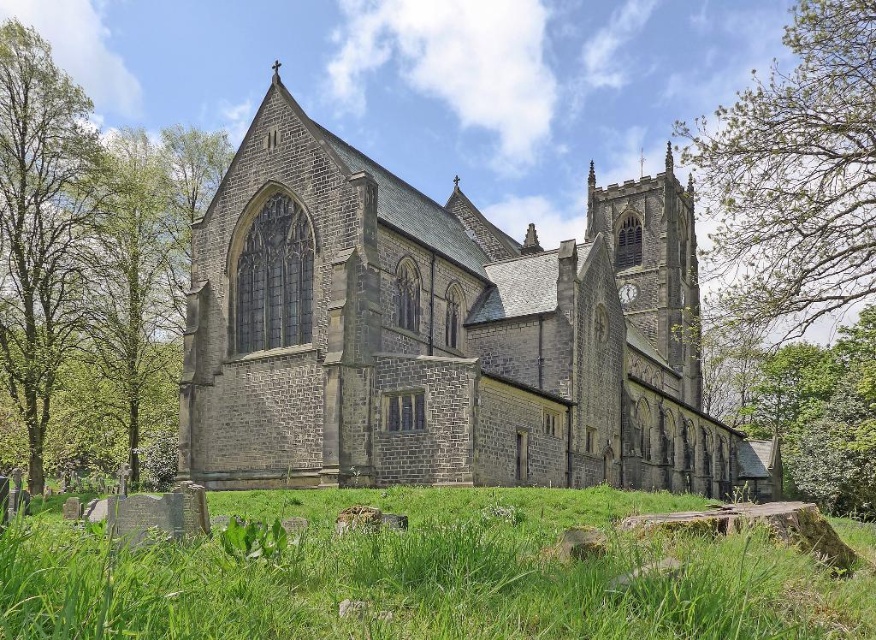
Is gray stone church at center above green grass at lower center?

Indeed, gray stone church at center is positioned over green grass at lower center.

You are a GUI agent. You are given a task and a screenshot of the screen. Output one action in this format:
    pyautogui.click(x=<x>, y=<y>)
    Task: Click on the gray stone church at center
    Image resolution: width=876 pixels, height=640 pixels.
    Given the screenshot: What is the action you would take?
    pyautogui.click(x=442, y=333)

Locate an element on the screen. The width and height of the screenshot is (876, 640). gray stone church at center is located at coordinates (442, 333).

Is the position of gray stone church at center less distant than that of green leafy branches at upper right?

Yes.

Which is behind, point (446, 240) or point (793, 282)?

Positioned behind is point (793, 282).

Is point (230, 445) positioned behind point (802, 308)?

No, (230, 445) is in front of (802, 308).

At what (x,y) coordinates should I click in order to perform the action: click on gray stone church at center. Please return your answer as a coordinate pair (x, y). This screenshot has width=876, height=640. Looking at the image, I should click on (442, 333).

Which is behind, point (458, 317) or point (8, 320)?

The point (8, 320) is more distant.

Is point (330, 360) farther from camera compared to point (20, 324)?

No, it is not.

Who is more forward, (246,262) or (27,368)?

Point (246,262) is in front.

The image size is (876, 640). Find the location of `gray stone church at center`. gray stone church at center is located at coordinates (442, 333).